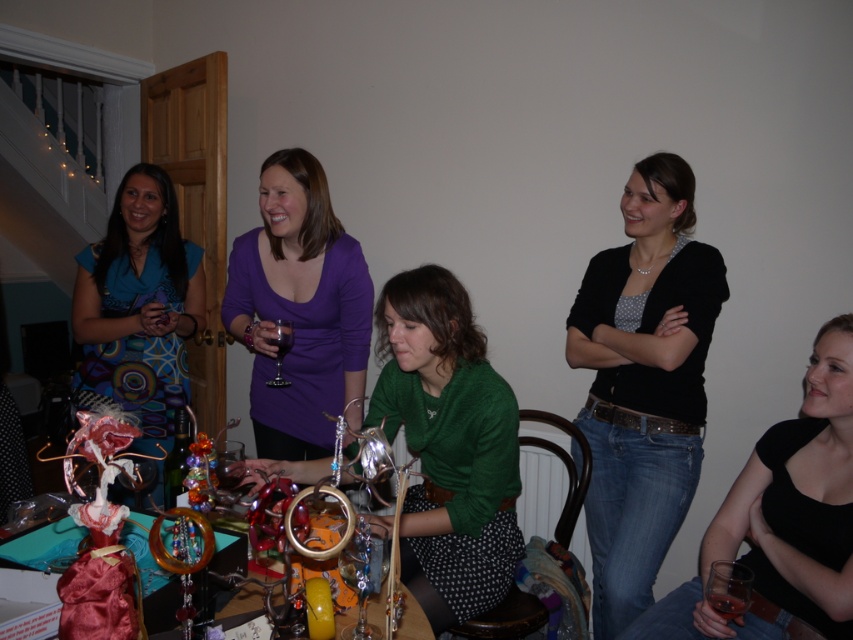
Can you confirm if green matte sweater at center is smaller than shiny metallic jewelry stand at center?

No, green matte sweater at center is not smaller than shiny metallic jewelry stand at center.

Is point (392, 307) positioned behind point (67, 548)?

Yes, point (392, 307) is farther from viewer.

Identify the location of green matte sweater at center. This screenshot has width=853, height=640. (448, 445).

This screenshot has height=640, width=853. I want to click on green matte sweater at center, so click(448, 445).

Does matte blue dress at left have a lesser width compared to transparent glass wine glass at lower right?

In fact, matte blue dress at left might be wider than transparent glass wine glass at lower right.

Between point (164, 376) and point (711, 588), which one is positioned behind?

Positioned behind is point (164, 376).

Is point (163, 282) closer to viewer compared to point (712, 561)?

No, it is behind (712, 561).

You are a GUI agent. You are given a task and a screenshot of the screen. Output one action in this format:
    pyautogui.click(x=<x>, y=<y>)
    Task: Click on the matte blue dress at left
    The width and height of the screenshot is (853, 640).
    Given the screenshot: What is the action you would take?
    pyautogui.click(x=138, y=305)

Can you confirm if matte blue dress at left is positioned above transparent glass wine glass at center?

Correct, matte blue dress at left is located above transparent glass wine glass at center.

Identify the location of matte blue dress at left. Image resolution: width=853 pixels, height=640 pixels. click(x=138, y=305).

This screenshot has width=853, height=640. Find the location of `matte blue dress at left`. matte blue dress at left is located at coordinates (138, 305).